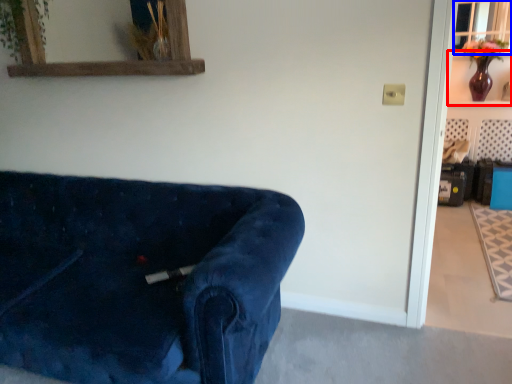
Question: Which point is further to the camera, shelf (highlighted by a red box) or window (highlighted by a blue box)?

Choices:
 (A) shelf
 (B) window

Answer: (B)